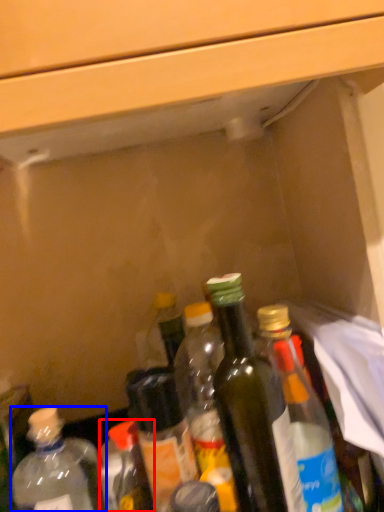
Question: Which object is closer to the camera taking this photo, bottle (highlighted by a red box) or bottle (highlighted by a blue box)?

Choices:
 (A) bottle
 (B) bottle

Answer: (B)